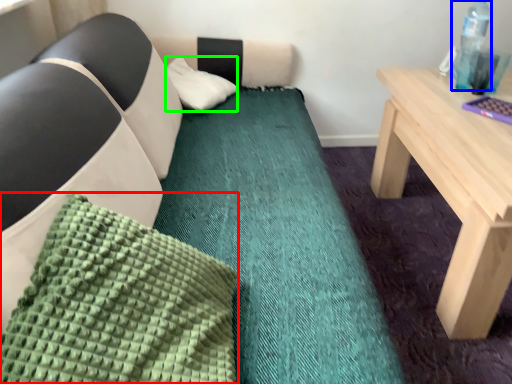
Question: Based on their relative distances, which object is farther from pillow (highlighted by a red box)? Choose from bottle (highlighted by a blue box) and pillow (highlighted by a green box).

Choices:
 (A) bottle
 (B) pillow

Answer: (A)